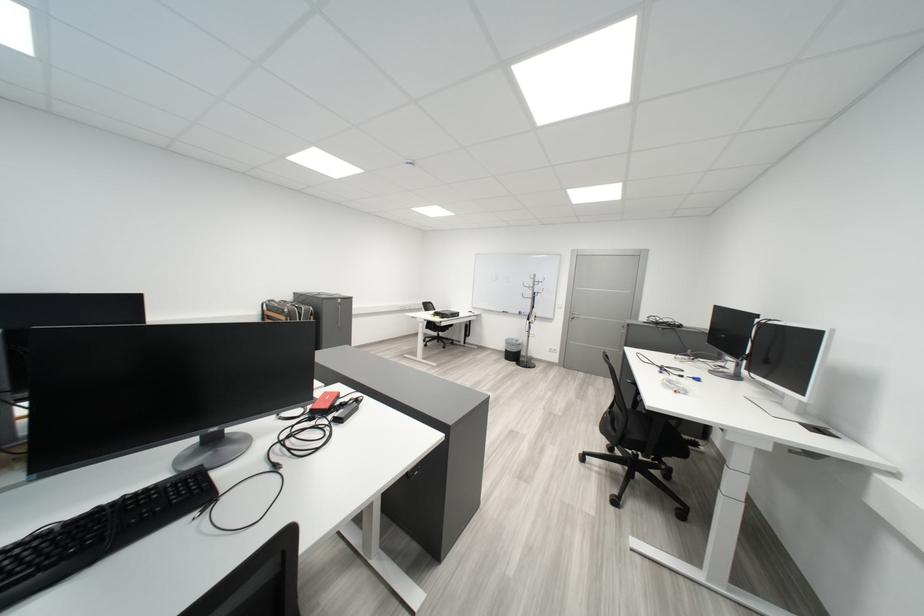
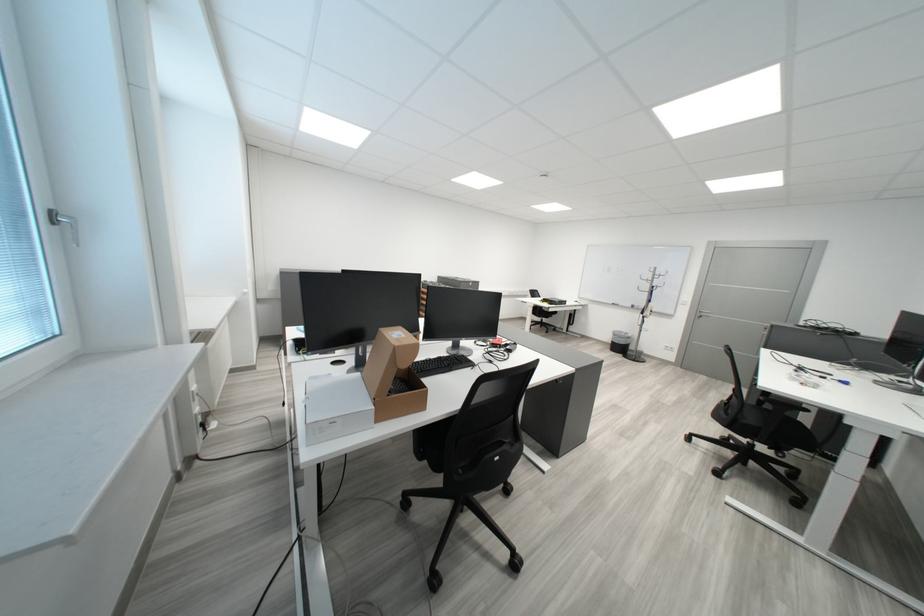
Where in the second image is the point corresponding to (649,437) from the first image?

(763, 422)